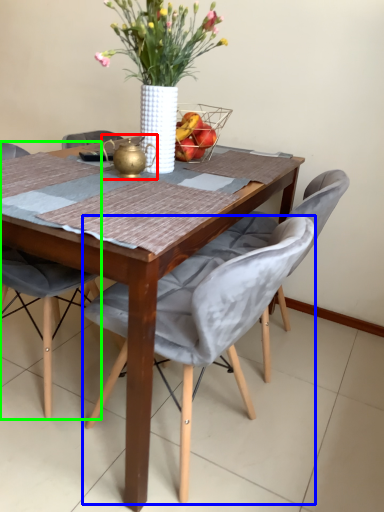
Question: Which is nearer to the tea pot (highlighted by a red box)? chair (highlighted by a blue box) or chair (highlighted by a green box).

Choices:
 (A) chair
 (B) chair

Answer: (A)